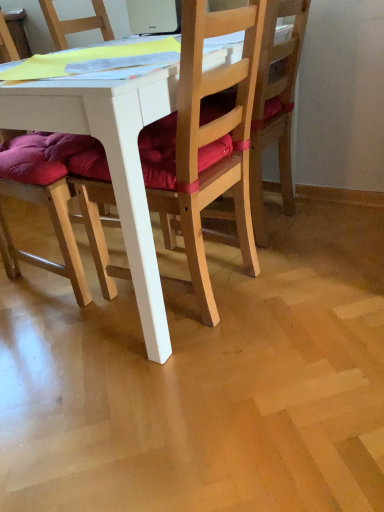
You are a GUI agent. You are given a task and a screenshot of the screen. Output one action in this format:
    pyautogui.click(x=<x>, y=<y>)
    Task: Click on the purple cushioned chair at left, arranged as the first chair when viewed from the left
    The image size is (384, 512).
    Given the screenshot: What is the action you would take?
    pyautogui.click(x=40, y=202)

The image size is (384, 512). Identify the location of white plastic laptop at upper center. (154, 16).

Image resolution: width=384 pixels, height=512 pixels. What do you see at coordinates (206, 144) in the screenshot? I see `wooden chair at center, which appears as the second chair when viewed from the right` at bounding box center [206, 144].

Where is `wooden chair at center, the 1th chair from the right`? wooden chair at center, the 1th chair from the right is located at coordinates (275, 106).

Could you tell me if wooden chair at center, which is the 3th chair in left-to-right order, is turned towards purple cushioned chair at left, arranged as the first chair when viewed from the left?

No, wooden chair at center, which is the 3th chair in left-to-right order, does not turn towards purple cushioned chair at left, arranged as the first chair when viewed from the left.

Which is in front, point (264, 245) or point (7, 180)?

The point (7, 180) is closer to the camera.

Is wooden chair at center, which is the 3th chair in left-to-right order, to the left of purple cushioned chair at left, marked as the 3th chair in a right-to-left arrangement, from the viewer's perspective?

No.

Is wooden chair at center, the 1th chair from the right, wider or thinner than purple cushioned chair at left, marked as the 3th chair in a right-to-left arrangement?

Clearly, wooden chair at center, the 1th chair from the right, has less width compared to purple cushioned chair at left, marked as the 3th chair in a right-to-left arrangement.

Can you confirm if wooden chair at center, positioned as the second chair in left-to-right order, is taller than white plastic laptop at upper center?

Yes, wooden chair at center, positioned as the second chair in left-to-right order, is taller than white plastic laptop at upper center.

Does wooden chair at center, positioned as the second chair in left-to-right order, lie behind white plastic laptop at upper center?

No.

From the picture: Is white plastic laptop at upper center at the back of wooden chair at center, positioned as the second chair in left-to-right order?

wooden chair at center, positioned as the second chair in left-to-right order, does not have its back to white plastic laptop at upper center.

Which of these two, white plastic laptop at upper center or wooden chair at center, which appears as the second chair when viewed from the right, is wider?

With larger width is wooden chair at center, which appears as the second chair when viewed from the right.

Identify the location of the 3rd chair below the white plastic laptop at upper center (from the image's perspective). (206, 144).

Looking at this image, can you confirm if white plastic laptop at upper center is positioned to the left of wooden chair at center, which appears as the second chair when viewed from the right?

Yes.

In the scene shown: How different are the orientations of white plastic laptop at upper center and wooden chair at center, positioned as the second chair in left-to-right order, in degrees?

They differ by 93.3 degrees in their facing directions.

This screenshot has height=512, width=384. Find the location of `chair that is the 2nd object to the right of the white plastic laptop at upper center, starting at the anchor`. chair that is the 2nd object to the right of the white plastic laptop at upper center, starting at the anchor is located at coordinates (275, 106).

Is white plastic laptop at upper center smaller than wooden chair at center, which is the 3th chair in left-to-right order?

Yes, white plastic laptop at upper center is smaller than wooden chair at center, which is the 3th chair in left-to-right order.

Is purple cushioned chair at left, marked as the 3th chair in a right-to-left arrangement, positioned before wooden chair at center, the 1th chair from the right?

Yes, purple cushioned chair at left, marked as the 3th chair in a right-to-left arrangement, is in front of wooden chair at center, the 1th chair from the right.

Could you measure the distance between purple cushioned chair at left, marked as the 3th chair in a right-to-left arrangement, and wooden chair at center, which is the 3th chair in left-to-right order?

purple cushioned chair at left, marked as the 3th chair in a right-to-left arrangement, is 72.58 centimeters from wooden chair at center, which is the 3th chair in left-to-right order.

Is purple cushioned chair at left, marked as the 3th chair in a right-to-left arrangement, not close to wooden chair at center, the 1th chair from the right?

No.

Is purple cushioned chair at left, marked as the 3th chair in a right-to-left arrangement, thinner than wooden chair at center, the 1th chair from the right?

No.

Considering the sizes of white plastic laptop at upper center and purple cushioned chair at left, arranged as the first chair when viewed from the left, in the image, is white plastic laptop at upper center wider or thinner than purple cushioned chair at left, arranged as the first chair when viewed from the left,?

white plastic laptop at upper center is thinner than purple cushioned chair at left, arranged as the first chair when viewed from the left.

Does point (176, 0) appear closer or farther from the camera than point (67, 234)?

Point (176, 0) appears to be farther away from the viewer than point (67, 234).

The width and height of the screenshot is (384, 512). Find the location of `chair on the left of white plastic laptop at upper center`. chair on the left of white plastic laptop at upper center is located at coordinates (40, 202).

Who is bigger, white plastic laptop at upper center or purple cushioned chair at left, arranged as the first chair when viewed from the left?

With larger size is purple cushioned chair at left, arranged as the first chair when viewed from the left.

Where is `chair that is the 1st object located above the wooden chair at center, which appears as the second chair when viewed from the right (from the image's perspective)`? chair that is the 1st object located above the wooden chair at center, which appears as the second chair when viewed from the right (from the image's perspective) is located at coordinates (40, 202).

Does wooden chair at center, positioned as the second chair in left-to-right order, lie behind purple cushioned chair at left, arranged as the first chair when viewed from the left?

No, the depth of wooden chair at center, positioned as the second chair in left-to-right order, is less than that of purple cushioned chair at left, arranged as the first chair when viewed from the left.

Between point (176, 186) and point (15, 267), which one is positioned in front?

The point (176, 186) is more forward.

From the image's perspective, which one is positioned higher, wooden chair at center, which appears as the second chair when viewed from the right, or purple cushioned chair at left, arranged as the first chair when viewed from the left?

purple cushioned chair at left, arranged as the first chair when viewed from the left, is shown above in the image.

This screenshot has height=512, width=384. There is a purple cushioned chair at left, marked as the 3th chair in a right-to-left arrangement. Identify the location of the 1st chair below it (from a real-world perspective). (275, 106).

The image size is (384, 512). In order to click on the 1st chair counting from the right side of the white plastic laptop at upper center in this screenshot , I will do `click(206, 144)`.

When comparing their distances from wooden chair at center, the 1th chair from the right, does purple cushioned chair at left, arranged as the first chair when viewed from the left, or wooden chair at center, positioned as the second chair in left-to-right order, seem further?

purple cushioned chair at left, arranged as the first chair when viewed from the left, lies further to wooden chair at center, the 1th chair from the right, than the other object.

Estimate the real-world distances between objects in this image. Which object is closer to wooden chair at center, which is the 3th chair in left-to-right order, wooden chair at center, positioned as the second chair in left-to-right order, or white plastic laptop at upper center?

wooden chair at center, positioned as the second chair in left-to-right order, lies closer to wooden chair at center, which is the 3th chair in left-to-right order, than the other object.

Looking at the image, which one is located closer to purple cushioned chair at left, arranged as the first chair when viewed from the left, white plastic laptop at upper center or wooden chair at center, the 1th chair from the right?

wooden chair at center, the 1th chair from the right, is closer to purple cushioned chair at left, arranged as the first chair when viewed from the left.

Looking at the image, which one is located further to wooden chair at center, the 1th chair from the right, white plastic laptop at upper center or purple cushioned chair at left, arranged as the first chair when viewed from the left?

purple cushioned chair at left, arranged as the first chair when viewed from the left, lies further to wooden chair at center, the 1th chair from the right, than the other object.

Looking at the image, which one is located further to white plastic laptop at upper center, wooden chair at center, which is the 3th chair in left-to-right order, or wooden chair at center, which appears as the second chair when viewed from the right?

wooden chair at center, which appears as the second chair when viewed from the right, lies further to white plastic laptop at upper center than the other object.

Considering their positions, is wooden chair at center, which appears as the second chair when viewed from the right, positioned closer to wooden chair at center, the 1th chair from the right, than purple cushioned chair at left, marked as the 3th chair in a right-to-left arrangement?

wooden chair at center, which appears as the second chair when viewed from the right.

Looking at the image, which one is located closer to white plastic laptop at upper center, wooden chair at center, the 1th chair from the right, or purple cushioned chair at left, marked as the 3th chair in a right-to-left arrangement?

The object closer to white plastic laptop at upper center is wooden chair at center, the 1th chair from the right.

Based on their spatial positions, is white plastic laptop at upper center or purple cushioned chair at left, marked as the 3th chair in a right-to-left arrangement, closer to wooden chair at center, positioned as the second chair in left-to-right order?

purple cushioned chair at left, marked as the 3th chair in a right-to-left arrangement, is closer to wooden chair at center, positioned as the second chair in left-to-right order.

This screenshot has height=512, width=384. In order to click on chair between purple cushioned chair at left, marked as the 3th chair in a right-to-left arrangement, and wooden chair at center, which is the 3th chair in left-to-right order, from left to right in this screenshot , I will do `click(206, 144)`.

Locate an element on the screen. Image resolution: width=384 pixels, height=512 pixels. laptop between purple cushioned chair at left, arranged as the first chair when viewed from the left, and wooden chair at center, which is the 3th chair in left-to-right order, in the horizontal direction is located at coordinates (154, 16).